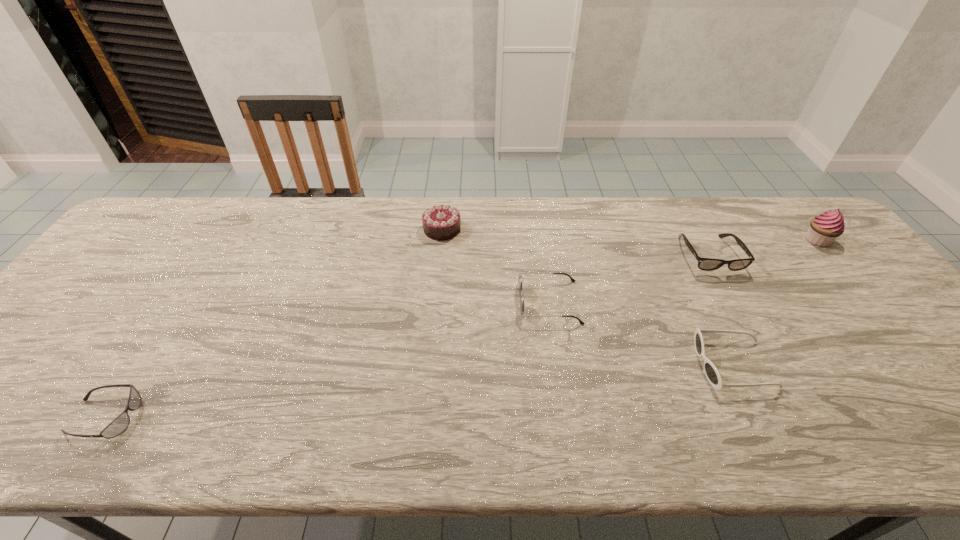
The width and height of the screenshot is (960, 540). In order to click on vacant area located on the left of the rightmost object in this screenshot , I will do `click(676, 240)`.

Locate an element on the screen. The image size is (960, 540). free space located on the left of the fifth shortest object is located at coordinates [x=388, y=229].

This screenshot has width=960, height=540. In order to click on vacant point located 0.180m on the lenses of the spectacles in this screenshot , I will do (749, 327).

You are a GUI agent. You are given a task and a screenshot of the screen. Output one action in this format:
    pyautogui.click(x=<x>, y=<y>)
    Task: Click on the vacant space located on the front-facing side of the third object from left to right
    The width and height of the screenshot is (960, 540).
    Given the screenshot: What is the action you would take?
    pyautogui.click(x=492, y=302)

You are a GUI agent. You are given a task and a screenshot of the screen. Output one action in this format:
    pyautogui.click(x=<x>, y=<y>)
    Task: Click on the vacant point located on the front-facing side of the third object from left to right
    This screenshot has height=540, width=960.
    Given the screenshot: What is the action you would take?
    pyautogui.click(x=463, y=302)

This screenshot has width=960, height=540. I want to click on free region located on the front-facing side of the third object from left to right, so click(x=473, y=302).

The height and width of the screenshot is (540, 960). Find the location of `free space located with the lenses of the rightmost sunglasses facing outward`. free space located with the lenses of the rightmost sunglasses facing outward is located at coordinates (526, 365).

This screenshot has height=540, width=960. Find the location of `vacant space located 0.230m with the lenses of the rightmost sunglasses facing outward`. vacant space located 0.230m with the lenses of the rightmost sunglasses facing outward is located at coordinates (599, 365).

At what (x,y) coordinates should I click in order to perform the action: click on blank area located with the lenses of the rightmost sunglasses facing outward. Please return your answer as a coordinate pair (x, y). Looking at the image, I should click on coord(625,365).

This screenshot has width=960, height=540. In order to click on blank area located on the lenses of the leftmost sunglasses in this screenshot , I will do `click(165, 417)`.